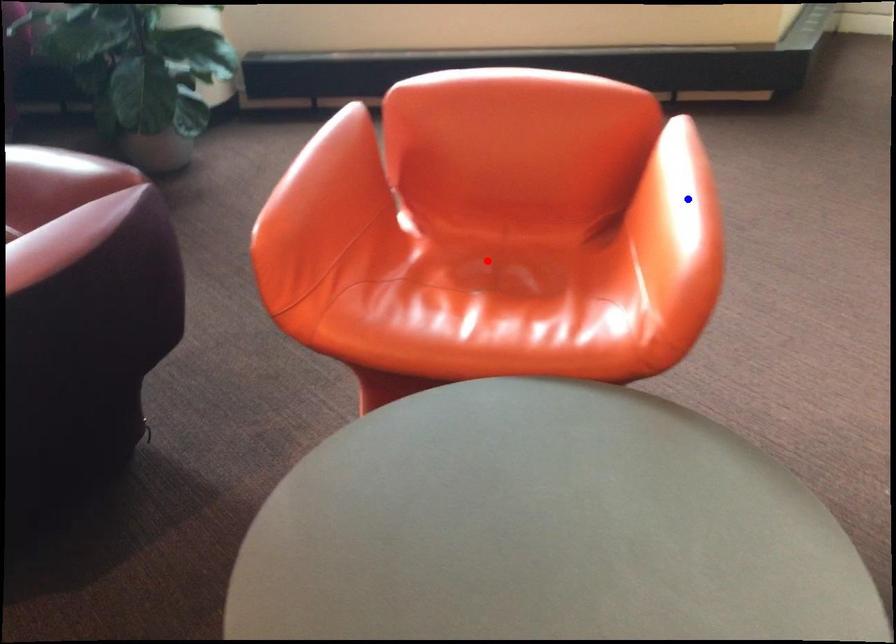
Question: In the image, two points are highlighted. Which point is nearer to the camera? Reply with the corresponding letter.

Choices:
 (A) blue point
 (B) red point

Answer: (A)